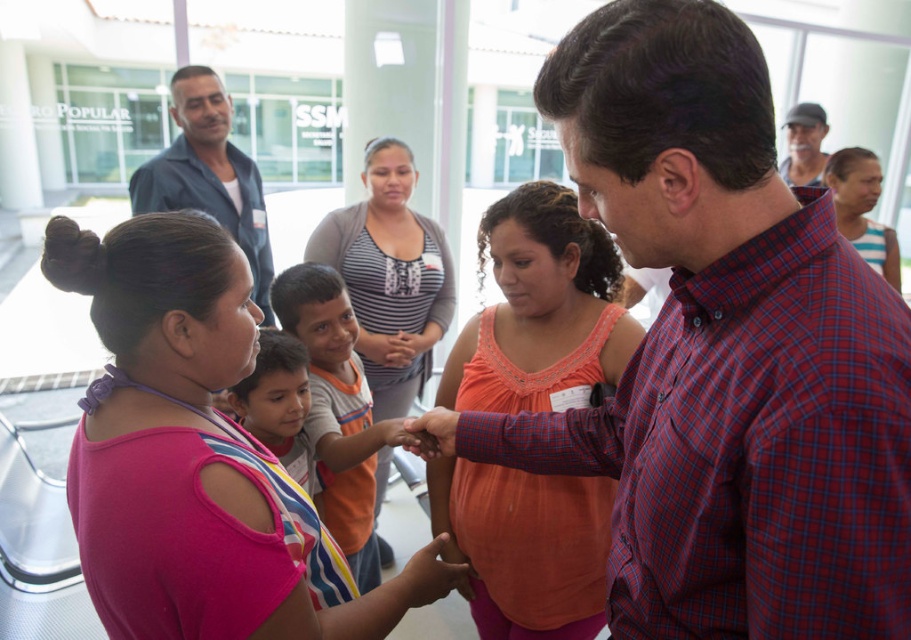
You are organizing a photo shoot and need to place two shirts on a mannequin. The pink fabric shirt at center and the orange cotton shirt at center must be arranged so that the wider shirt is on the left side. Which shirt should go on the left?

The pink fabric shirt at center should be placed on the left side because its width surpasses that of the orange cotton shirt at center, making it the wider option.

You are a photographer trying to capture a candid shot of the orange cotton tank top at center and the striped fabric shirt at upper right. Since you want both subjects to be in focus, you need to know which one is taller. Can you tell me which is taller?

The orange cotton tank top at center is much taller than the striped fabric shirt at upper right.

You are standing in the scene and want to take a photo of both the point at coordinates point (x=207, y=467) and point (x=331, y=280). Which point should you focus on first to ensure both are in focus?

You should focus on point (x=331, y=280) first because it is farther from the camera, ensuring that both points will be in focus when using a depth of field that includes both distances.